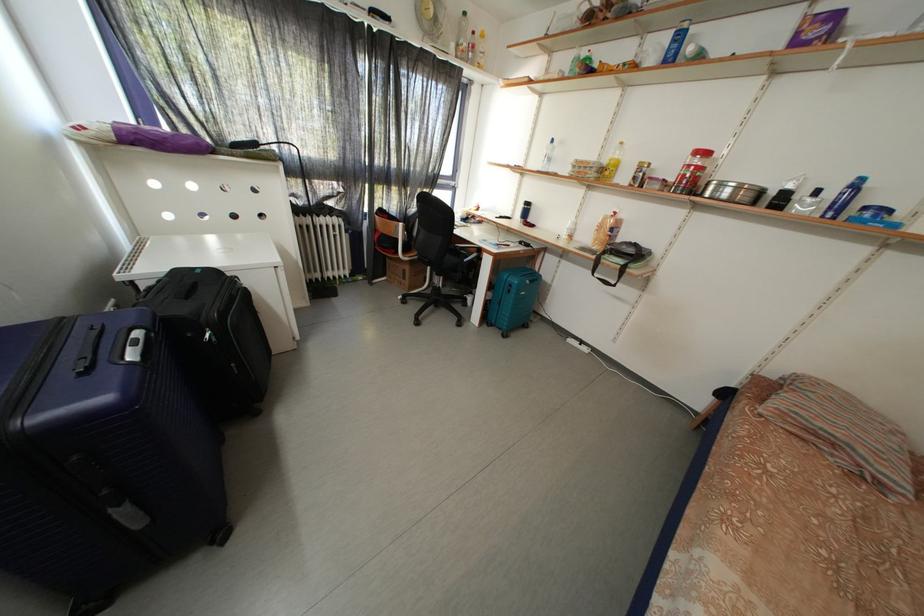
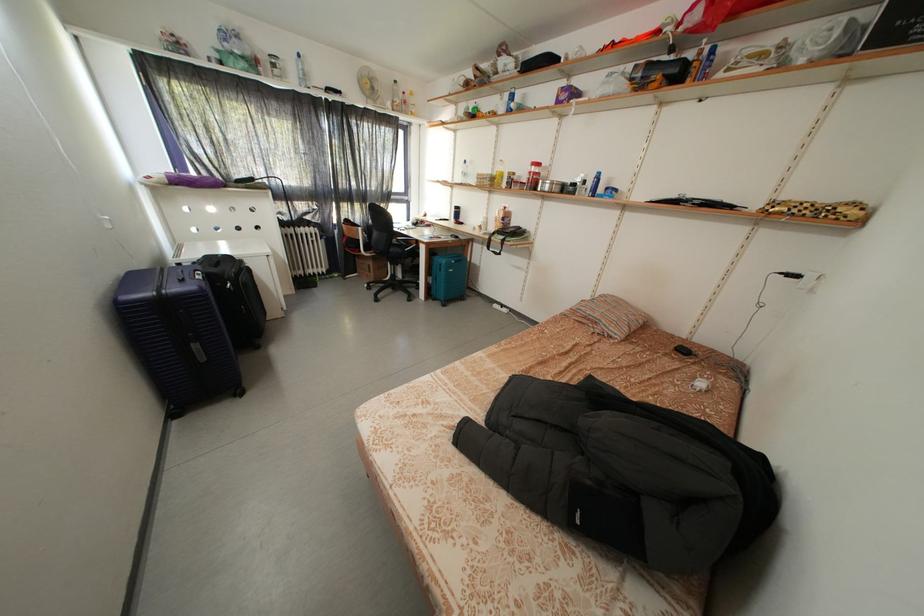
Where in the second image is the point corresponding to (232,318) from the first image?

(246, 280)